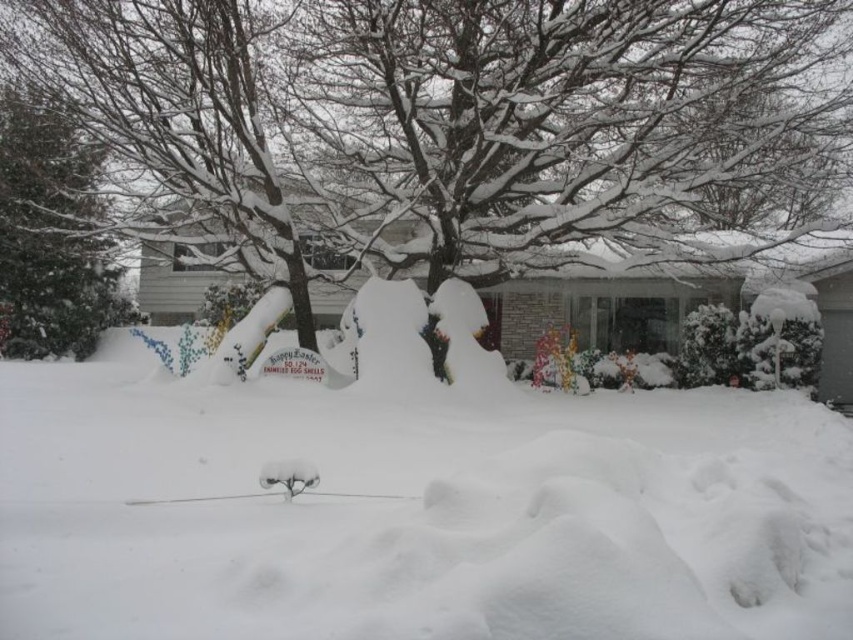
In the scene shown: You are planning to build a snow fort using the snow from the white fluffy snow at center and the green leafy tree at left. Which location would provide more snow material for the fort?

The white fluffy snow at center has a larger width than the green leafy tree at left, so it would provide more snow material for the fort.

You are planning to build a snow fort in the middle of the white fluffy snow at center. The green leafy tree at left is in the way. Can you move the tree to make space?

The green leafy tree at left is 19.24 meters away from the white fluffy snow at center. Since the tree is a living plant, it cannot be moved easily without causing damage, so you should consider building the snow fort elsewhere.